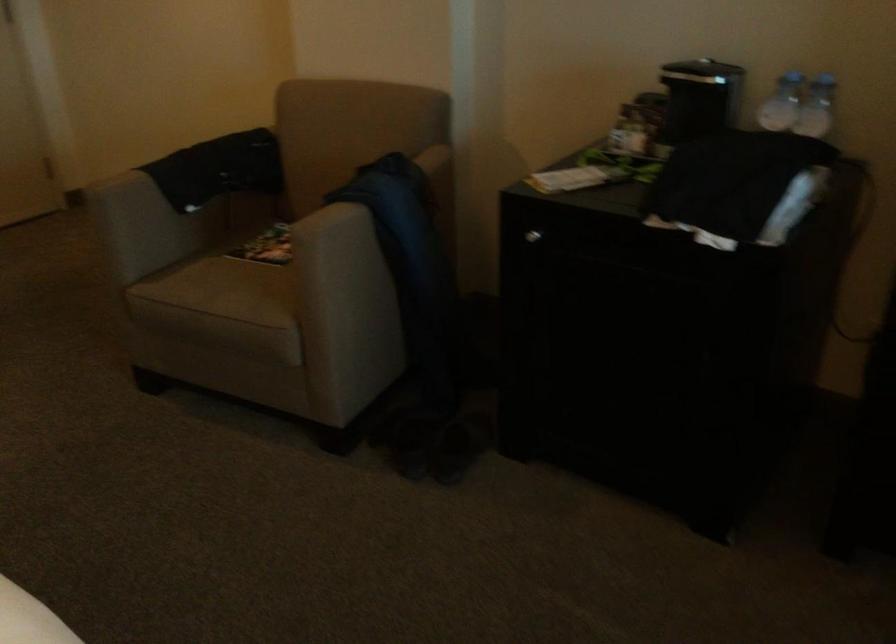
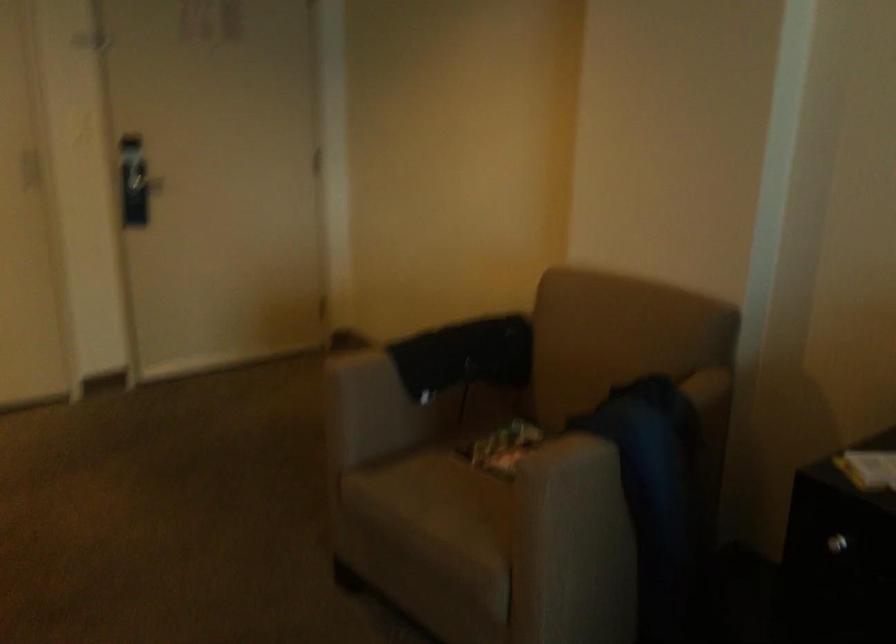
Question: The camera is either moving clockwise (left) or counter-clockwise (right) around the object. The first image is from the beginning of the video and the second image is from the end. Is the camera moving left or right when shooting the video?

Choices:
 (A) Left
 (B) Right

Answer: (B)